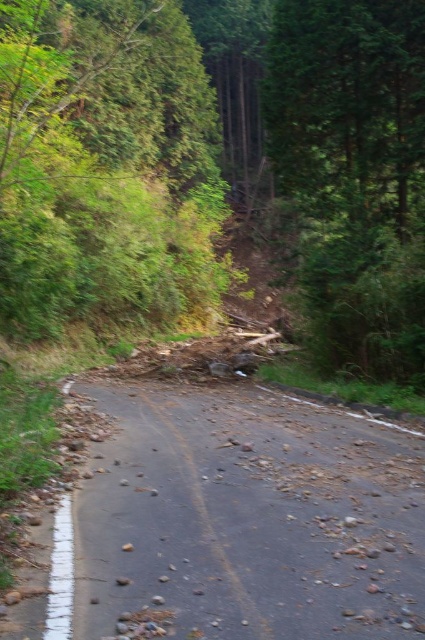
Question: Which of the following is the closest to the observer?

Choices:
 (A) click(x=308, y=88)
 (B) click(x=175, y=417)
 (C) click(x=2, y=83)

Answer: (B)

Question: Can you confirm if dull asphalt road at center is positioned to the right of green textured tree at center?

Choices:
 (A) no
 (B) yes

Answer: (A)

Question: Is dull asphalt road at center further to camera compared to green textured tree at center?

Choices:
 (A) no
 (B) yes

Answer: (A)

Question: Which point appears closest to the camera in this image?

Choices:
 (A) (346, 108)
 (B) (144, 483)

Answer: (B)

Question: Does green leafy tree at upper left appear over green textured tree at center?

Choices:
 (A) yes
 (B) no

Answer: (A)

Question: Which of the following is the farthest from the observer?

Choices:
 (A) (357, 348)
 (B) (422, 544)

Answer: (A)